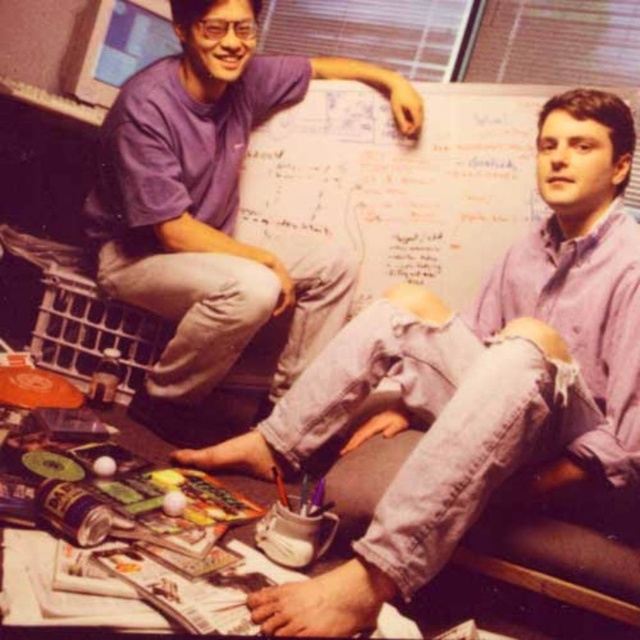
Looking at this image, is denim jeans at center wider than purple cotton shirt at upper left?

Yes.

Does denim jeans at center come in front of purple cotton shirt at upper left?

Yes.

This screenshot has height=640, width=640. I want to click on denim jeans at center, so click(x=477, y=380).